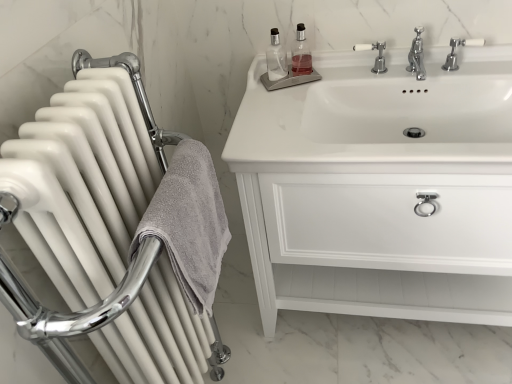
Question: Is white glossy sink at upper right completely or partially inside white ceramic tap at upper center, which appears as the second tap when viewed from the right?

Choices:
 (A) yes
 (B) no

Answer: (B)

Question: Is white ceramic tap at upper center, which appears as the second tap when viewed from the right, thinner than white glossy sink at upper right?

Choices:
 (A) yes
 (B) no

Answer: (A)

Question: Is white glossy sink at upper right at the back of white ceramic tap at upper center, which appears as the second tap when viewed from the right?

Choices:
 (A) no
 (B) yes

Answer: (A)

Question: Does white ceramic tap at upper center, which appears as the second tap when viewed from the right, turn towards white glossy sink at upper right?

Choices:
 (A) no
 (B) yes

Answer: (A)

Question: Is white ceramic tap at upper center, the first tap positioned from the left, far away from white glossy sink at upper right?

Choices:
 (A) yes
 (B) no

Answer: (B)

Question: From a real-world perspective, is white ceramic tap at upper center, the first tap positioned from the left, on top of white glossy sink at upper right?

Choices:
 (A) no
 (B) yes

Answer: (B)

Question: Is white glossy sink at upper right smaller than white plastic tap at upper right, arranged as the 1th tap when viewed from the right?

Choices:
 (A) no
 (B) yes

Answer: (A)

Question: Are white glossy sink at upper right and white plastic tap at upper right, marked as the 2th tap in a left-to-right arrangement, beside each other?

Choices:
 (A) no
 (B) yes

Answer: (A)

Question: Is white plastic tap at upper right, marked as the 2th tap in a left-to-right arrangement, a part of white glossy sink at upper right?

Choices:
 (A) yes
 (B) no

Answer: (A)

Question: Is white glossy sink at upper right looking in the opposite direction of white plastic tap at upper right, arranged as the 1th tap when viewed from the right?

Choices:
 (A) yes
 (B) no

Answer: (B)

Question: Is white glossy sink at upper right taller than white plastic tap at upper right, arranged as the 1th tap when viewed from the right?

Choices:
 (A) yes
 (B) no

Answer: (A)

Question: Is white glossy sink at upper right behind white plastic tap at upper right, marked as the 2th tap in a left-to-right arrangement?

Choices:
 (A) yes
 (B) no

Answer: (B)

Question: Is white glossy cabinet at upper right at the left side of white glossy radiator at left?

Choices:
 (A) no
 (B) yes

Answer: (A)